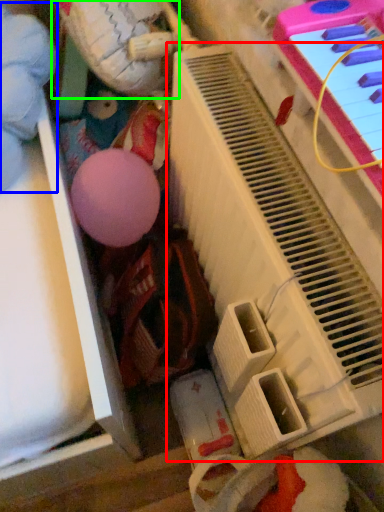
Question: Considering the real-world distances, which object is farthest from piano (highlighted by a red box)? toy (highlighted by a blue box) or toy (highlighted by a green box)?

Choices:
 (A) toy
 (B) toy

Answer: (A)